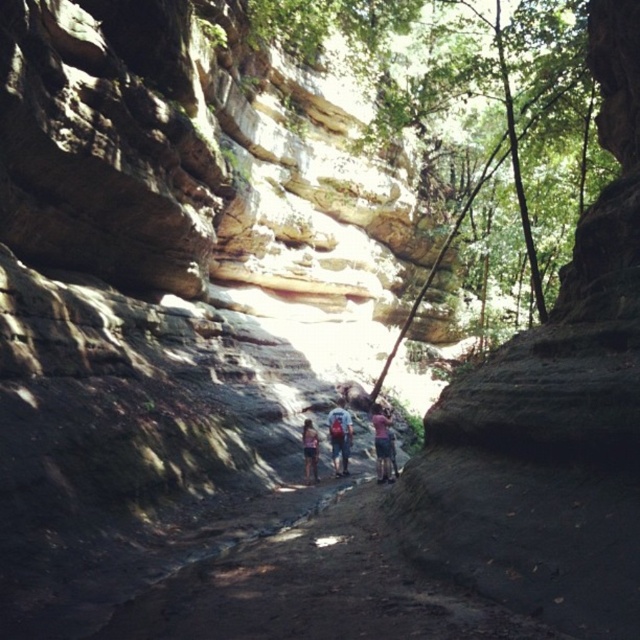
Between camouflage fabric backpack at center and denim shorts at center, which one appears on the left side from the viewer's perspective?

From the viewer's perspective, denim shorts at center appears more on the left side.

Does camouflage fabric backpack at center appear on the right side of denim shorts at center?

Correct, you'll find camouflage fabric backpack at center to the right of denim shorts at center.

The height and width of the screenshot is (640, 640). I want to click on camouflage fabric backpack at center, so click(x=339, y=436).

Which is more to the right, camouflage fabric backpack at center or pink fabric at center?

pink fabric at center is more to the right.

Can you confirm if camouflage fabric backpack at center is thinner than pink fabric at center?

Yes, camouflage fabric backpack at center is thinner than pink fabric at center.

Where is `camouflage fabric backpack at center`? Image resolution: width=640 pixels, height=640 pixels. camouflage fabric backpack at center is located at coordinates (339, 436).

Does pink fabric at center appear under denim shorts at center?

Correct, pink fabric at center is located below denim shorts at center.

Does point (372, 417) come farther from viewer compared to point (301, 424)?

Yes.

Locate an element on the screen. This screenshot has height=640, width=640. pink fabric at center is located at coordinates (381, 442).